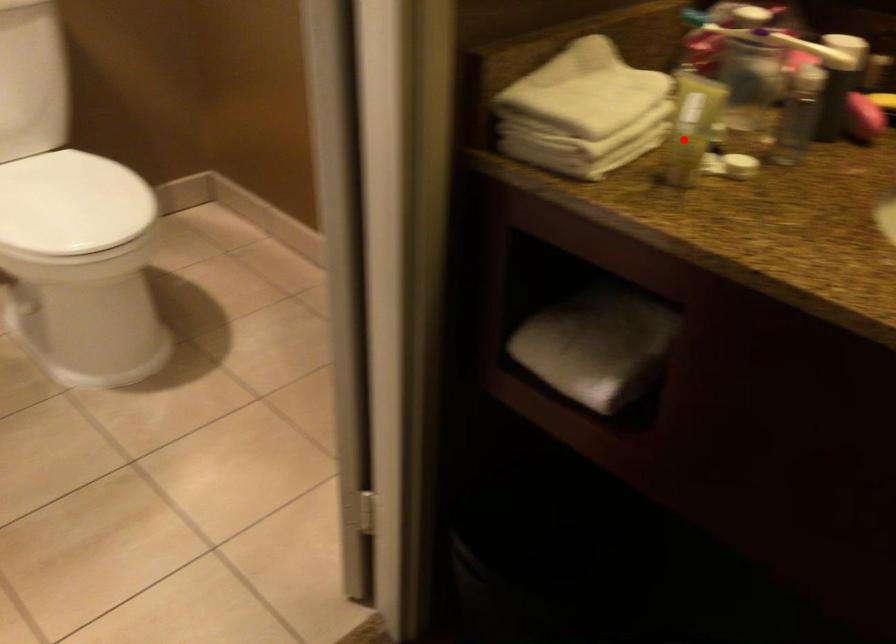
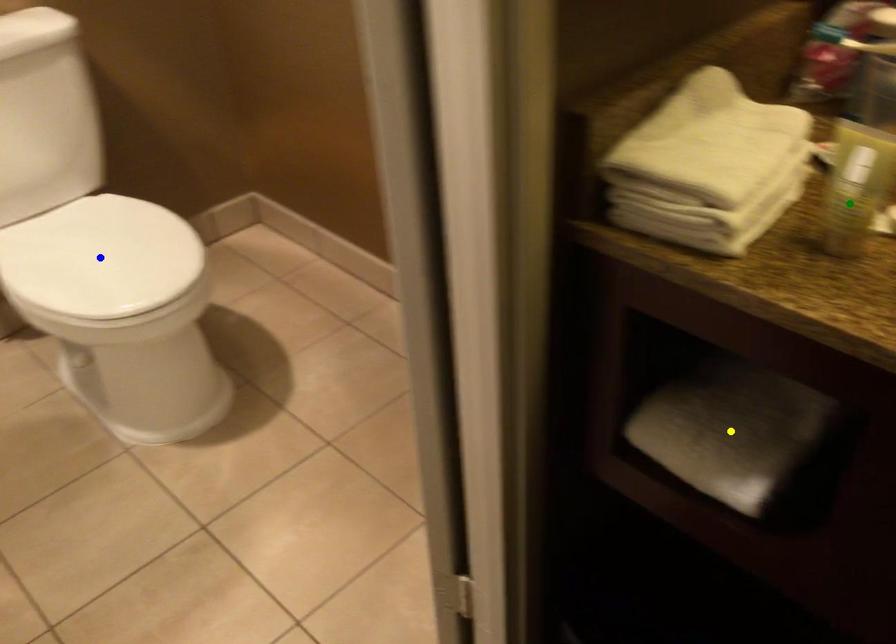
Question: I am providing you with two images of the same scene from different viewpoints. A red point is marked on the first image. You are given multiple points on the second image. Which point in image 2 is actually the same real-world point as the red point in image 1?

Choices:
 (A) green point
 (B) blue point
 (C) yellow point

Answer: (A)